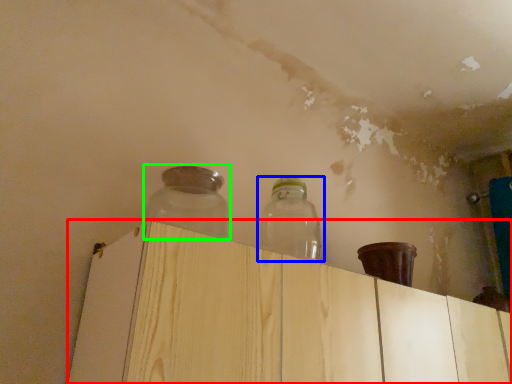
Question: Which object is positioned farthest from dresser (highlighted by a red box)? Select from bottle (highlighted by a blue box) and bottle (highlighted by a green box).

Choices:
 (A) bottle
 (B) bottle

Answer: (A)